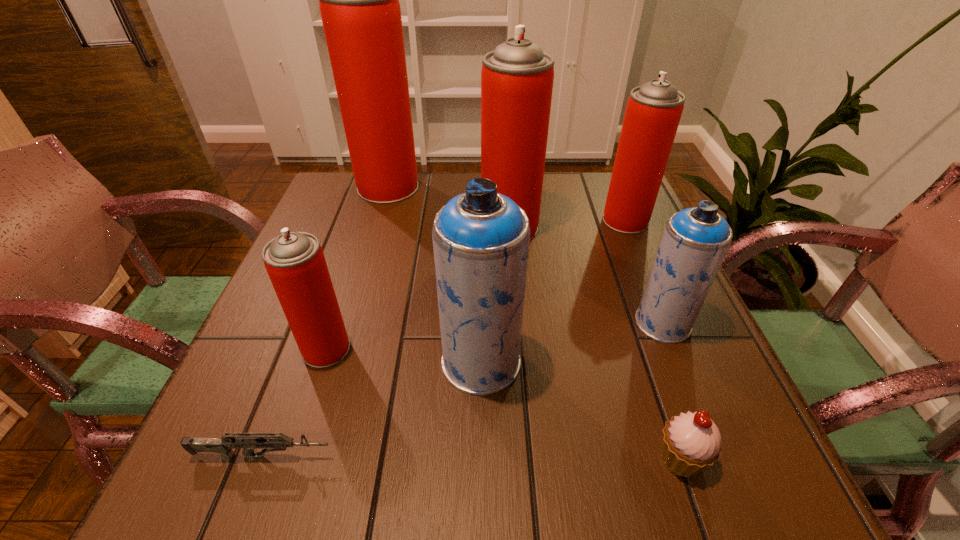
Identify the location of the third closest object relative to the gun. This screenshot has width=960, height=540. (691, 442).

The width and height of the screenshot is (960, 540). In order to click on the sixth closest object to the third biggest red aerosol can in this screenshot , I will do `click(295, 262)`.

Locate which aerosol can is the closest to the second smallest red aerosol can. Please provide its 2D coordinates. Your answer should be formatted as a tuple, i.e. [(x, y)], where the tuple contains the x and y coordinates of a point satisfying the conditions above.

[(517, 77)]

Identify which aerosol can is the fifth nearest to the seventh shortest object. Please provide its 2D coordinates. Your answer should be formatted as a tuple, i.e. [(x, y)], where the tuple contains the x and y coordinates of a point satisfying the conditions above.

[(295, 262)]

Point out which red aerosol can is positioned as the nearest to the cupcake. Please provide its 2D coordinates. Your answer should be formatted as a tuple, i.e. [(x, y)], where the tuple contains the x and y coordinates of a point satisfying the conditions above.

[(517, 77)]

Choose which red aerosol can is the second nearest neighbor to the third smallest red aerosol can. Please provide its 2D coordinates. Your answer should be formatted as a tuple, i.e. [(x, y)], where the tuple contains the x and y coordinates of a point satisfying the conditions above.

[(359, 4)]

Identify the location of free space that satisfies the following two spatial constraints: 1. on the front side of the left blue aerosol can; 2. aimed along the barrel of the gun. (481, 456).

You are a GUI agent. You are given a task and a screenshot of the screen. Output one action in this format:
    pyautogui.click(x=<x>, y=<y>)
    Task: Click on the vacant point that satisfies the following two spatial constraints: 1. on the back side of the second smallest red aerosol can; 2. on the left side of the left blue aerosol can
    The image size is (960, 540).
    Given the screenshot: What is the action you would take?
    pyautogui.click(x=481, y=220)

Where is `free space that satisfies the following two spatial constraints: 1. on the front side of the biggest red aerosol can; 2. on the left side of the second shortest object`? free space that satisfies the following two spatial constraints: 1. on the front side of the biggest red aerosol can; 2. on the left side of the second shortest object is located at coordinates (307, 458).